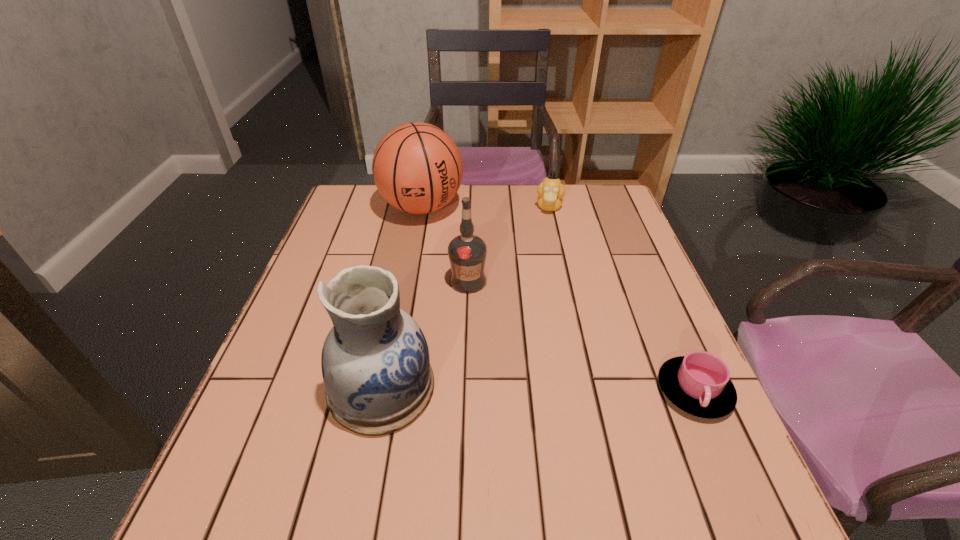
I want to click on vacant space that satisfies the following two spatial constraints: 1. on the back side of the pottery; 2. on the left side of the basketball, so click(418, 207).